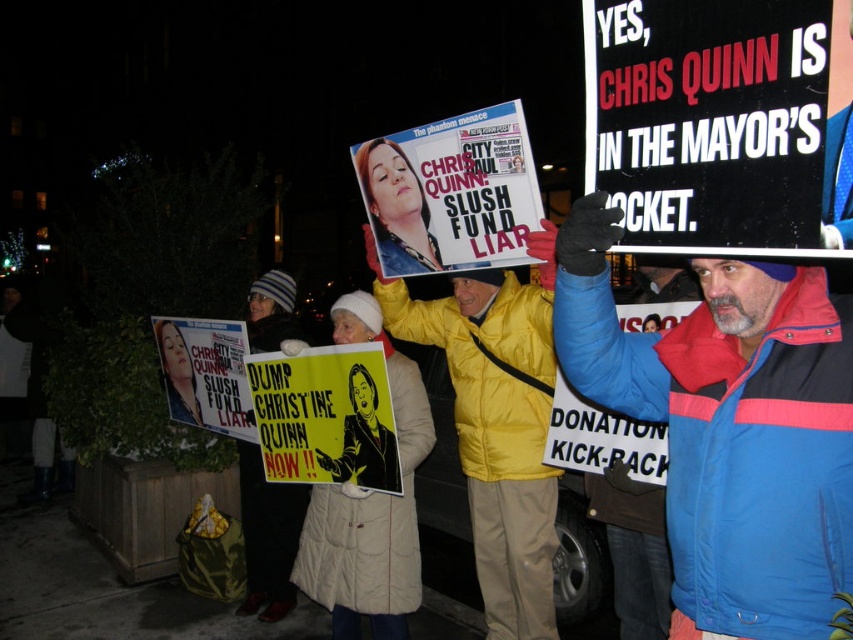
Question: Can you confirm if yellow paper poster at center is positioned below white paper sign at upper right?

Choices:
 (A) no
 (B) yes

Answer: (B)

Question: Does blue fleece jacket at upper right appear on the left side of yellow paper poster at center?

Choices:
 (A) yes
 (B) no

Answer: (B)

Question: Which point is closer to the camera taking this photo?

Choices:
 (A) (241, 380)
 (B) (440, 156)
 (C) (640, 330)
 (D) (547, 572)

Answer: (B)

Question: In this image, where is yellow puffy jacket at center located relative to yellow paper poster at center?

Choices:
 (A) right
 (B) left

Answer: (A)

Question: Which object is positioned closest to the blue fleece jacket at upper right?

Choices:
 (A) white paper sign at upper right
 (B) matte paper poster at lower left

Answer: (A)

Question: Estimate the real-world distances between objects in this image. Which object is farther from the yellow paper poster at center?

Choices:
 (A) matte black poster at center
 (B) matte paper poster at lower left
 (C) blue fleece jacket at upper right
 (D) white paper sign at upper right

Answer: (C)